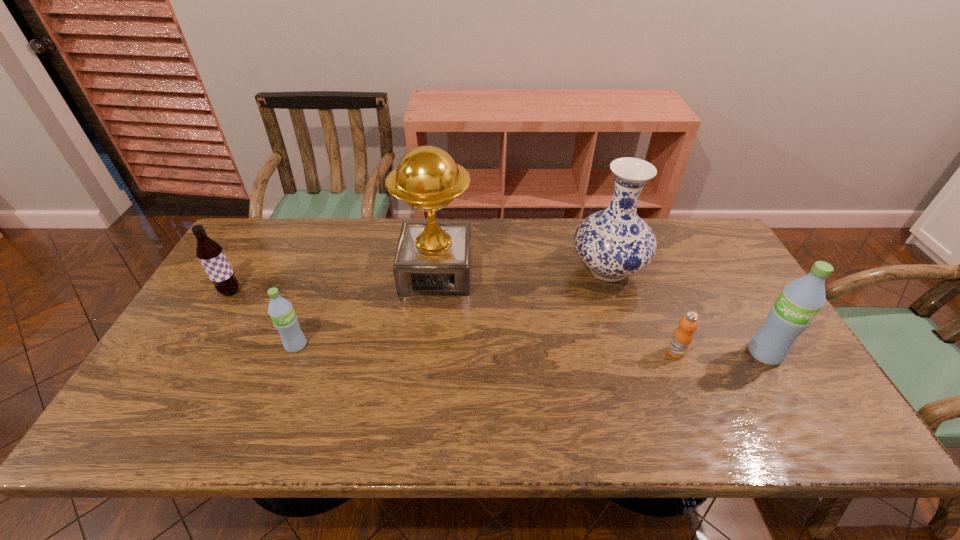
Locate an element on the screen. vacant area that lies between the taller water bottle and the root beer is located at coordinates (497, 322).

Identify the location of vacant region between the leftmost object and the right water bottle. (497, 322).

Where is `free space between the vase and the rightmost object`? This screenshot has width=960, height=540. free space between the vase and the rightmost object is located at coordinates (686, 312).

This screenshot has width=960, height=540. I want to click on unoccupied position between the taller water bottle and the left water bottle, so click(x=530, y=349).

This screenshot has height=540, width=960. Find the location of `object that stands as the second closest to the root beer`. object that stands as the second closest to the root beer is located at coordinates (433, 258).

Point out which object is positioned as the second nearest to the root beer. Please provide its 2D coordinates. Your answer should be formatted as a tuple, i.e. [(x, y)], where the tuple contains the x and y coordinates of a point satisfying the conditions above.

[(433, 258)]

Locate an element on the screen. free location that satisfies the following two spatial constraints: 1. on the front side of the vase; 2. on the right side of the third tallest object is located at coordinates (635, 354).